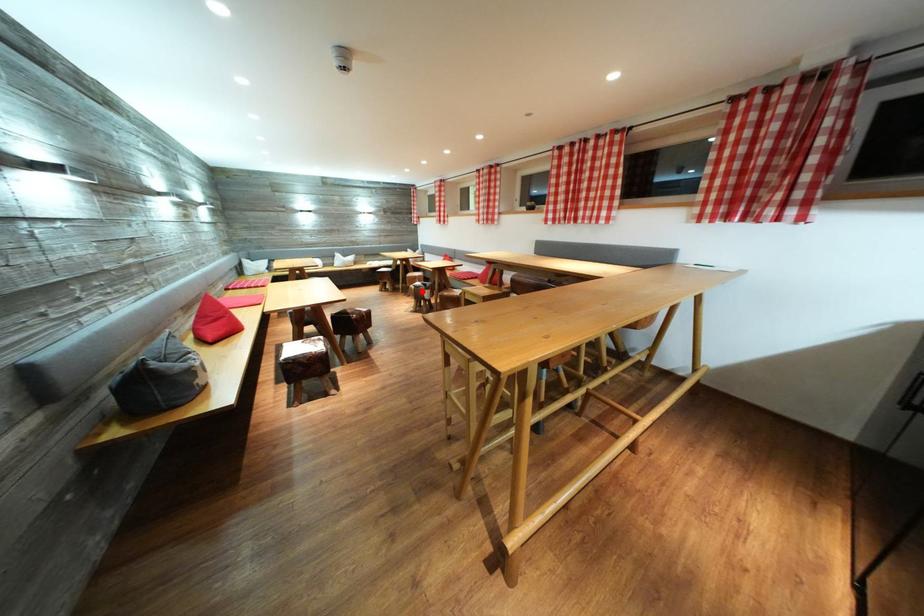
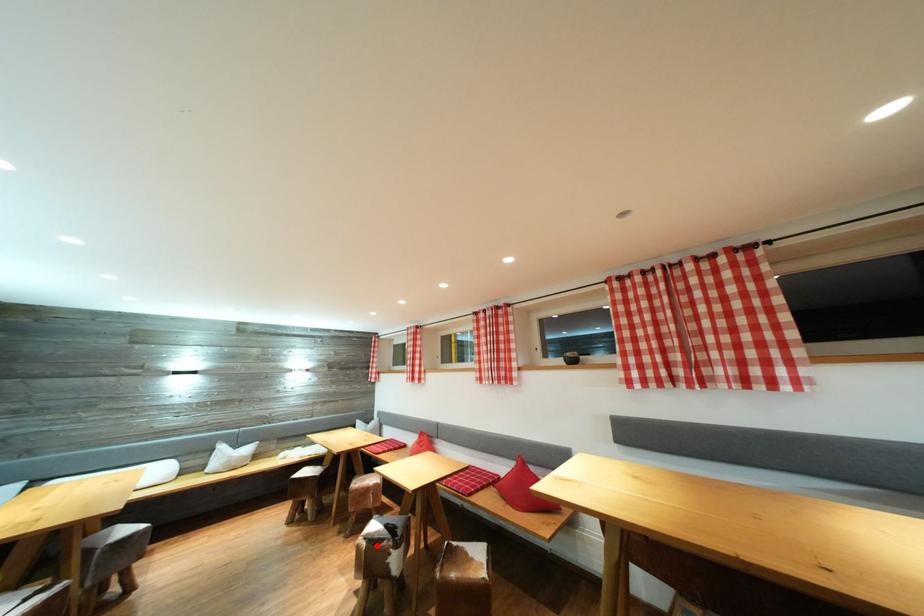
I am providing you with two images of the same scene from different viewpoints. A red point is marked on the first image and another point is marked on the second image. Is the marked point in image1 the same physical position as the marked point in image2?

Yes